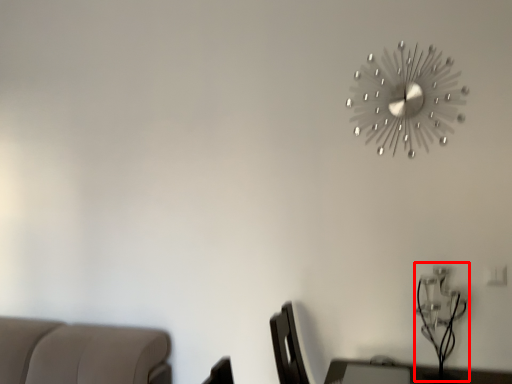
Question: From the image's perspective, considering the relative positions of table lamp (annotated by the red box) and wall clock in the image provided, where is table lamp (annotated by the red box) located with respect to the staircase?

Choices:
 (A) above
 (B) below

Answer: (B)